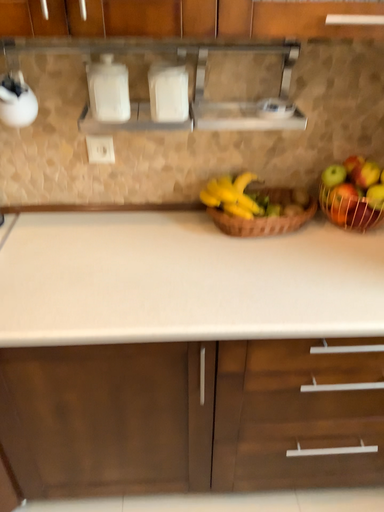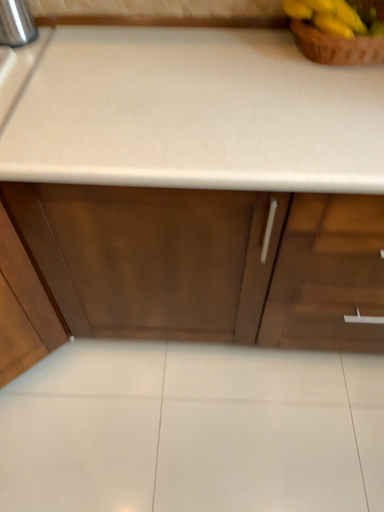
Question: How did the camera likely rotate when shooting the video?

Choices:
 (A) rotated downward
 (B) rotated upward

Answer: (A)